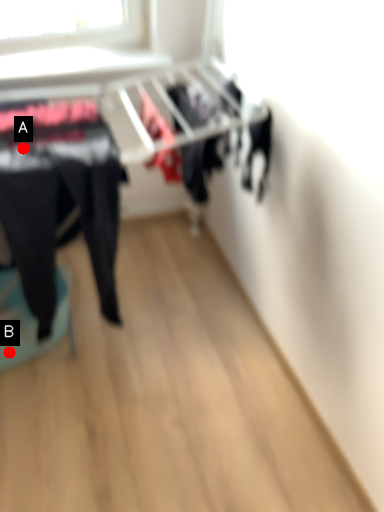
Question: Two points are circled on the image, labeled by A and B beside each circle. Which point is farther from the camera taking this photo?

Choices:
 (A) A is further
 (B) B is further

Answer: (B)